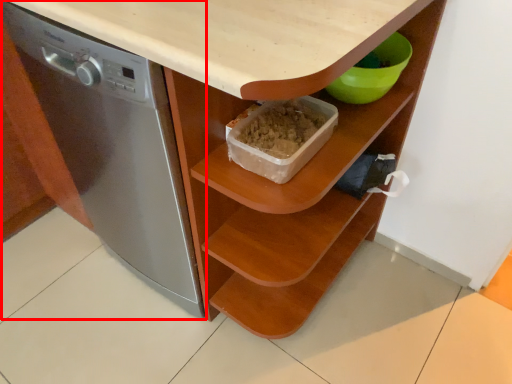
Question: Where is home appliance (annotated by the red box) located in relation to shelf in the image?

Choices:
 (A) left
 (B) right

Answer: (A)